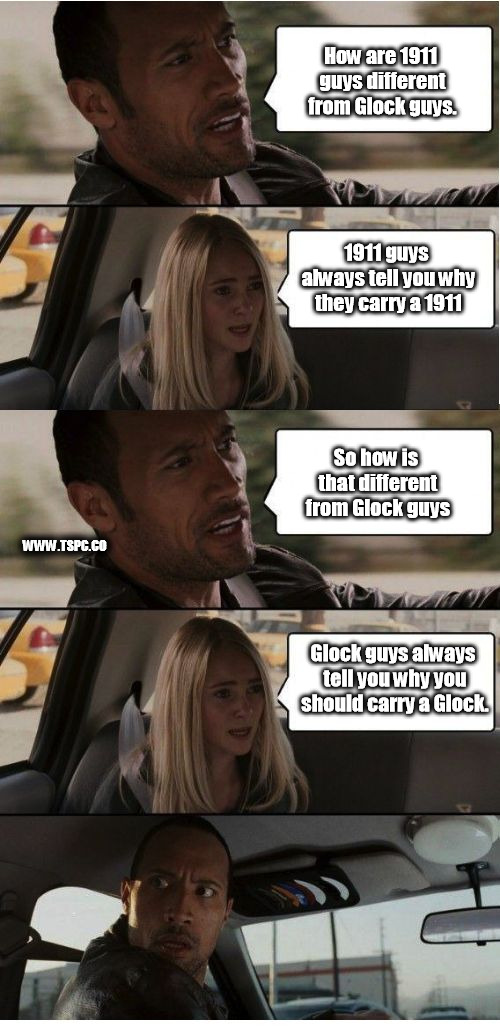
The height and width of the screenshot is (1026, 500). In order to click on unique frame in this screenshot , I will do `click(225, 939)`.